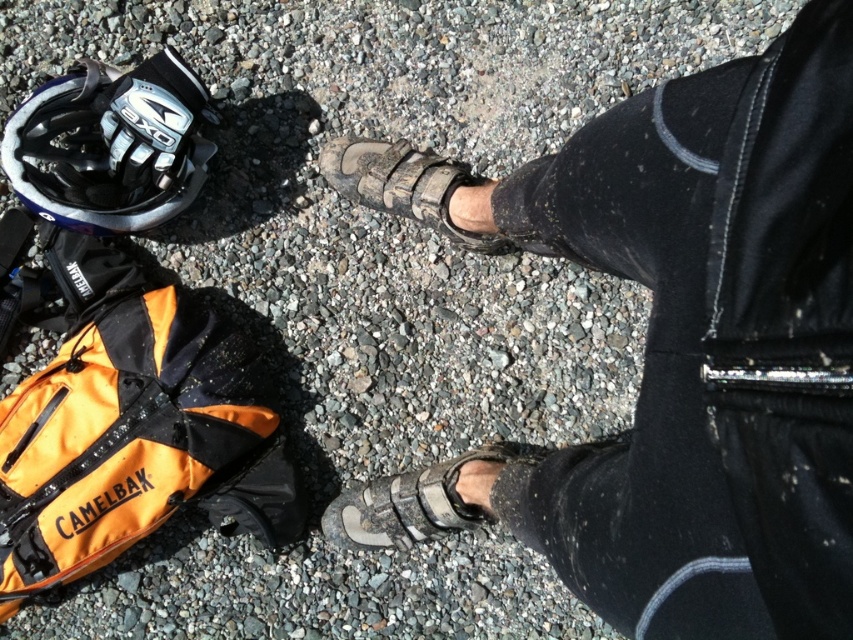
You are a hiker who needs to put on your footwear quickly. You see the leather sandals at center and the gray suede sandal at center. Which one is closer to your right hand if you are facing the image?

The gray suede sandal at center is closer to your right hand because it is positioned to the right of the leather sandals at center.

You are a hiker who just finished a trail and wants to place your matte black helmet at upper left and gray suede sandal at center on the ground. Based on the scene, where should you place each item so they don not get buried in the gravel?

The matte black helmet at upper left should be placed above the gray suede sandal at center to avoid being buried in the gravel since the helmet is positioned higher up.

You are a photographer trying to capture the gravelly ground surface in the image. You need to ensure that the leather sandals at center are not in the foreground of your photo. How far back should you move your camera from the current position to achieve this?

The leather sandals at center are currently 21.90 inches away from the viewer. To ensure they are not in the foreground, move the camera back so that the distance increases beyond 21.90 inches.